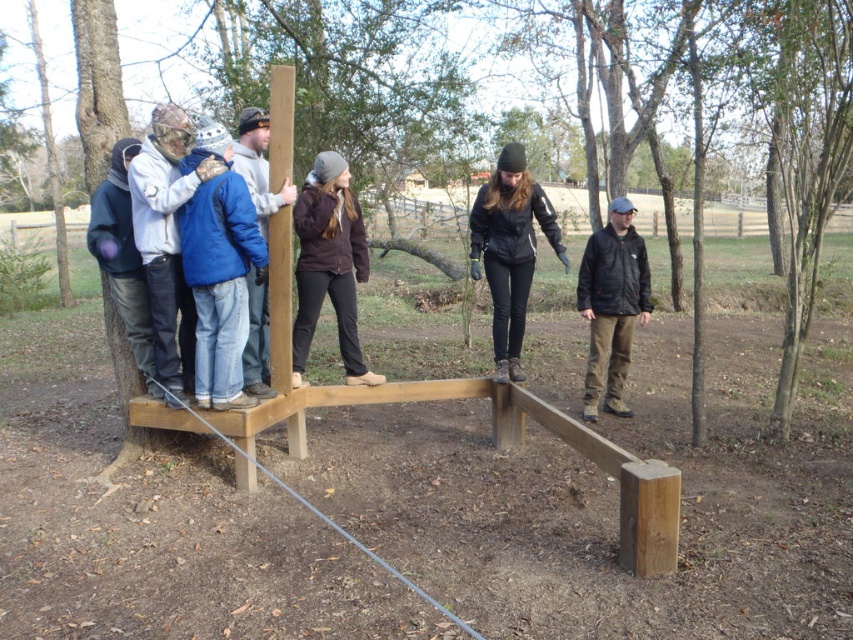
Question: Is brown wood tree at center below black matte jacket at right?

Choices:
 (A) yes
 (B) no

Answer: (B)

Question: Is brown wood tree at center closer to camera compared to black matte jacket at right?

Choices:
 (A) yes
 (B) no

Answer: (A)

Question: Does blue denim jacket at left appear over dark blue fleece jacket at left?

Choices:
 (A) no
 (B) yes

Answer: (B)

Question: Which of the following is the closest to the observer?

Choices:
 (A) click(x=584, y=392)
 (B) click(x=131, y=321)

Answer: (B)

Question: Which of the following is the closest to the observer?

Choices:
 (A) (605, 253)
 (B) (344, 282)
 (C) (340, 102)
 (D) (270, 195)

Answer: (D)

Question: Which of these objects is positioned farthest from the blue denim jacket at left?

Choices:
 (A) camouflage fabric jacket at left
 (B) brown leather jacket at upper center
 (C) black leather jacket at center
 (D) black matte jacket at right

Answer: (D)